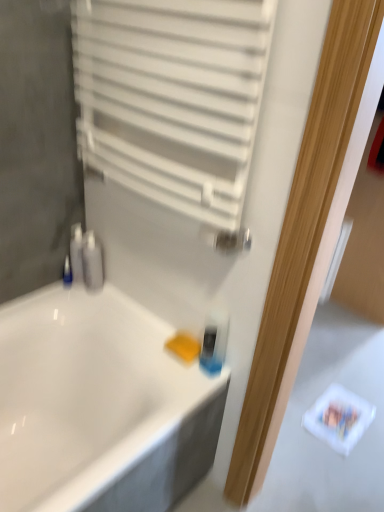
Identify the location of vacant region below white matte radiator at upper center (from a real-world perspective). (130, 318).